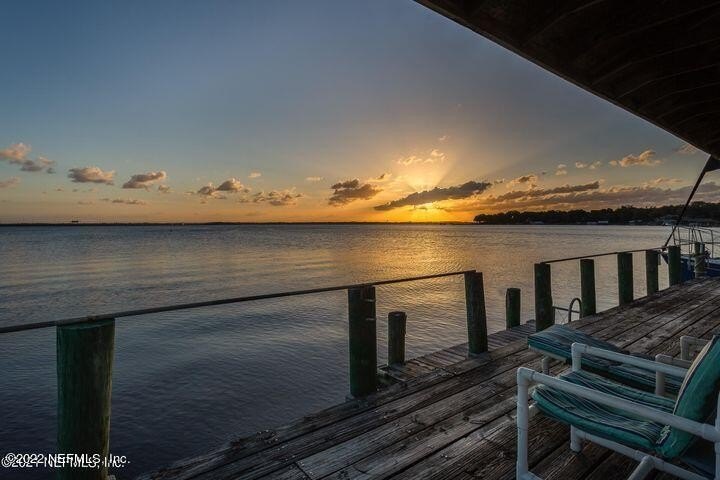
At what (x,y) coordinates should I click in order to perform the action: click on chair. Please return your answer as a coordinate pair (x, y). The height and width of the screenshot is (480, 720). Looking at the image, I should click on (613, 384), (680, 357).